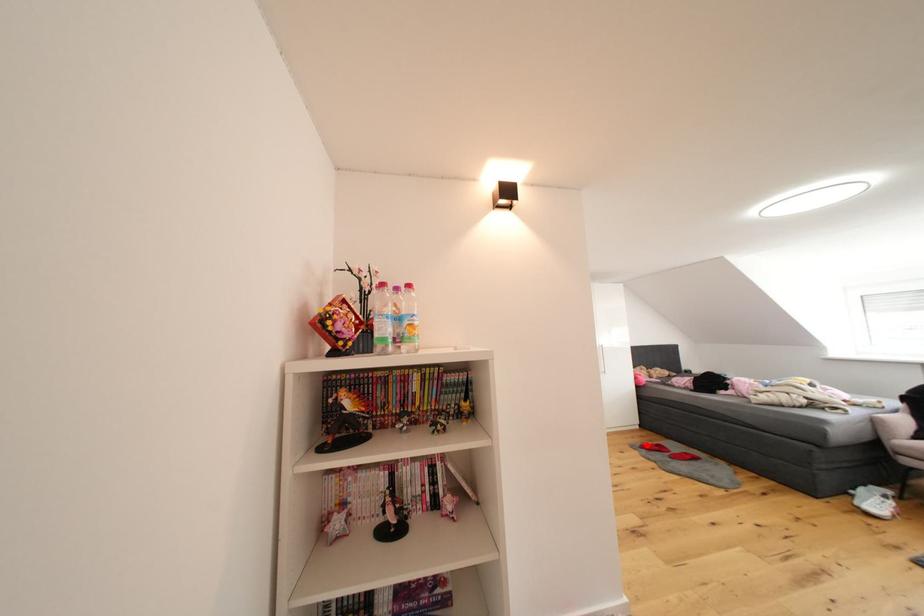
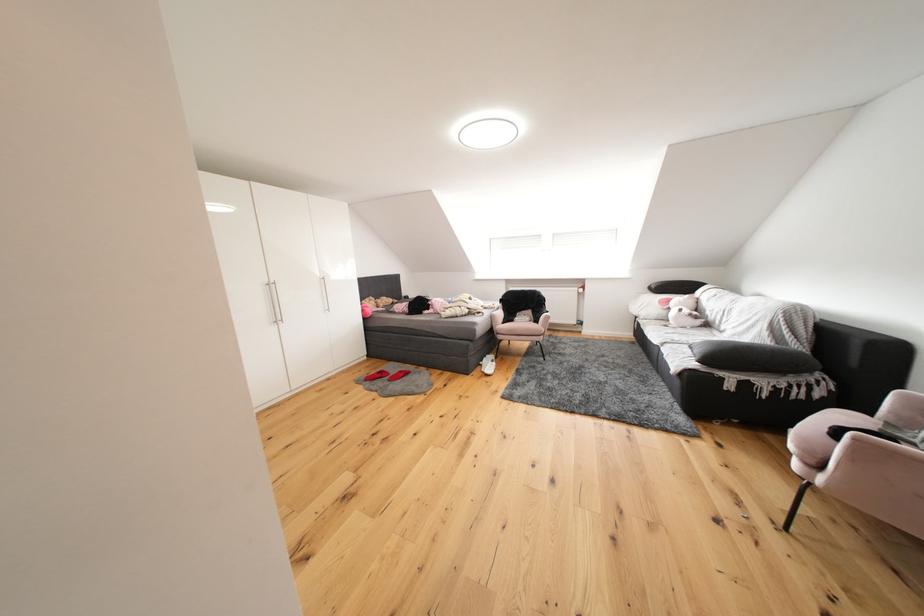
The point at the highlighted location is marked in the first image. Where is the corresponding point in the second image?

(372, 377)